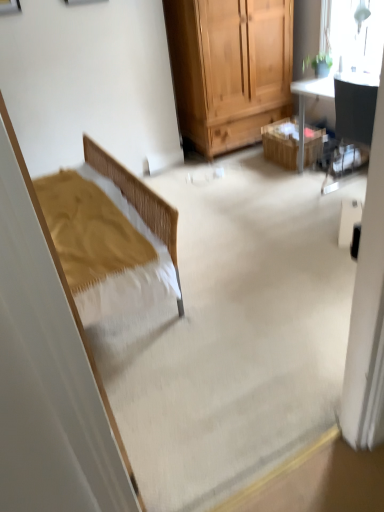
Question: From the image's perspective, relative to transparent glass window at upper right, is matte black chair at upper right above or below?

Choices:
 (A) above
 (B) below

Answer: (B)

Question: Relative to transparent glass window at upper right, is matte black chair at upper right in front or behind?

Choices:
 (A) front
 (B) behind

Answer: (A)

Question: Considering the real-world distances, which object is closest to the wooden picnic basket at center?

Choices:
 (A) transparent glass window at upper right
 (B) matte black chair at upper right

Answer: (B)

Question: Estimate the real-world distances between objects in this image. Which object is farther from the transparent glass window at upper right?

Choices:
 (A) matte black chair at upper right
 (B) wooden picnic basket at center

Answer: (B)